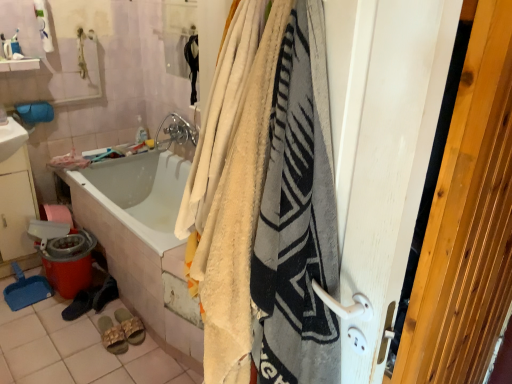
Question: Does black suede shoes at lower left, which ranks as the 2th footwear in left-to-right order, appear on the left side of chrome metallic faucet at upper center?

Choices:
 (A) yes
 (B) no

Answer: (A)

Question: Is black suede shoes at lower left, which is counted as the third footwear, starting from the right, directly adjacent to chrome metallic faucet at upper center?

Choices:
 (A) no
 (B) yes

Answer: (A)

Question: From the image's perspective, does black suede shoes at lower left, which ranks as the 2th footwear in left-to-right order, appear lower than chrome metallic faucet at upper center?

Choices:
 (A) no
 (B) yes

Answer: (B)

Question: Is the position of black suede shoes at lower left, which ranks as the 2th footwear in left-to-right order, more distant than that of chrome metallic faucet at upper center?

Choices:
 (A) no
 (B) yes

Answer: (A)

Question: From a real-world perspective, is black suede shoes at lower left, which is counted as the third footwear, starting from the right, located beneath chrome metallic faucet at upper center?

Choices:
 (A) yes
 (B) no

Answer: (A)

Question: Considering the positions of white glossy sink at upper left, which is the 2th sink from bottom to top, and soft cotton blanket at center in the image, is white glossy sink at upper left, which is the 2th sink from bottom to top, bigger or smaller than soft cotton blanket at center?

Choices:
 (A) small
 (B) big

Answer: (A)

Question: Visually, is white glossy sink at upper left, marked as the 1th sink in a top-to-bottom arrangement, positioned to the left or to the right of soft cotton blanket at center?

Choices:
 (A) right
 (B) left

Answer: (B)

Question: From a real-world perspective, is white glossy sink at upper left, marked as the 1th sink in a top-to-bottom arrangement, physically located above or below soft cotton blanket at center?

Choices:
 (A) above
 (B) below

Answer: (B)

Question: From the image's perspective, is white glossy sink at upper left, marked as the 1th sink in a top-to-bottom arrangement, above or below soft cotton blanket at center?

Choices:
 (A) below
 (B) above

Answer: (B)

Question: Based on their positions, is white glossy sink at lower left, which appears as the second sink when viewed from the top, located to the left or right of white wood screen door at right?

Choices:
 (A) right
 (B) left

Answer: (B)

Question: Looking at the image, does white glossy sink at lower left, placed as the 1th sink when sorted from bottom to top, seem bigger or smaller compared to white wood screen door at right?

Choices:
 (A) big
 (B) small

Answer: (B)

Question: In terms of width, does white glossy sink at lower left, placed as the 1th sink when sorted from bottom to top, look wider or thinner when compared to white wood screen door at right?

Choices:
 (A) wide
 (B) thin

Answer: (B)

Question: Do you think white glossy sink at lower left, placed as the 1th sink when sorted from bottom to top, is within white wood screen door at right, or outside of it?

Choices:
 (A) outside
 (B) inside

Answer: (A)

Question: In terms of width, does white glossy sink at lower left, placed as the 1th sink when sorted from bottom to top, look wider or thinner when compared to black suede shoes at lower left, which ranks as the 2th footwear in left-to-right order?

Choices:
 (A) thin
 (B) wide

Answer: (B)

Question: Does point pos(20,225) appear closer or farther from the camera than point pos(115,281)?

Choices:
 (A) closer
 (B) farther

Answer: (B)